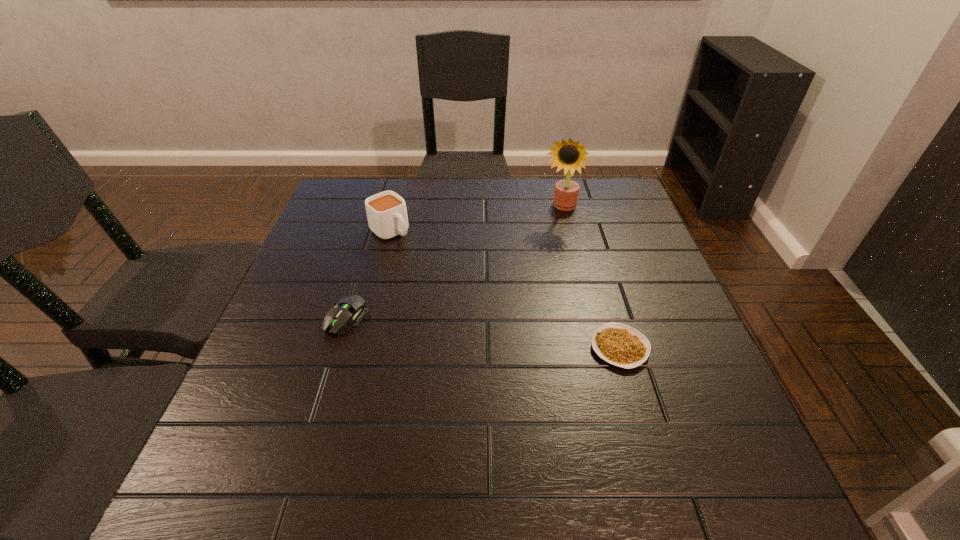
Find the location of a particular element. The height and width of the screenshot is (540, 960). vacant area that lies between the tallest object and the cup is located at coordinates (474, 220).

Find the location of a particular element. The width and height of the screenshot is (960, 540). vacant space in between the cup and the legume is located at coordinates (505, 290).

Image resolution: width=960 pixels, height=540 pixels. In order to click on free spot between the computer mouse and the legume in this screenshot , I will do `click(484, 333)`.

You are a GUI agent. You are given a task and a screenshot of the screen. Output one action in this format:
    pyautogui.click(x=<x>, y=<y>)
    Task: Click on the free spot between the legume and the third shortest object
    The width and height of the screenshot is (960, 540).
    Given the screenshot: What is the action you would take?
    [505, 290]

Find the location of a particular element. free spot between the sunflower and the second tallest object is located at coordinates (474, 220).

You are a GUI agent. You are given a task and a screenshot of the screen. Output one action in this format:
    pyautogui.click(x=<x>, y=<y>)
    Task: Click on the closest object to the shortest object
    
    Given the screenshot: What is the action you would take?
    pos(569,155)

Identify which object is the nearest to the tallest object. Please provide its 2D coordinates. Your answer should be formatted as a tuple, i.e. [(x, y)], where the tuple contains the x and y coordinates of a point satisfying the conditions above.

[(386, 212)]

Where is `free space in the image that satisfies the following two spatial constraints: 1. on the back side of the cup; 2. on the right side of the sunflower`? free space in the image that satisfies the following two spatial constraints: 1. on the back side of the cup; 2. on the right side of the sunflower is located at coordinates [396, 209].

In order to click on free space that satisfies the following two spatial constraints: 1. on the back side of the tallest object; 2. on the right side of the third tallest object in this screenshot , I will do `click(380, 209)`.